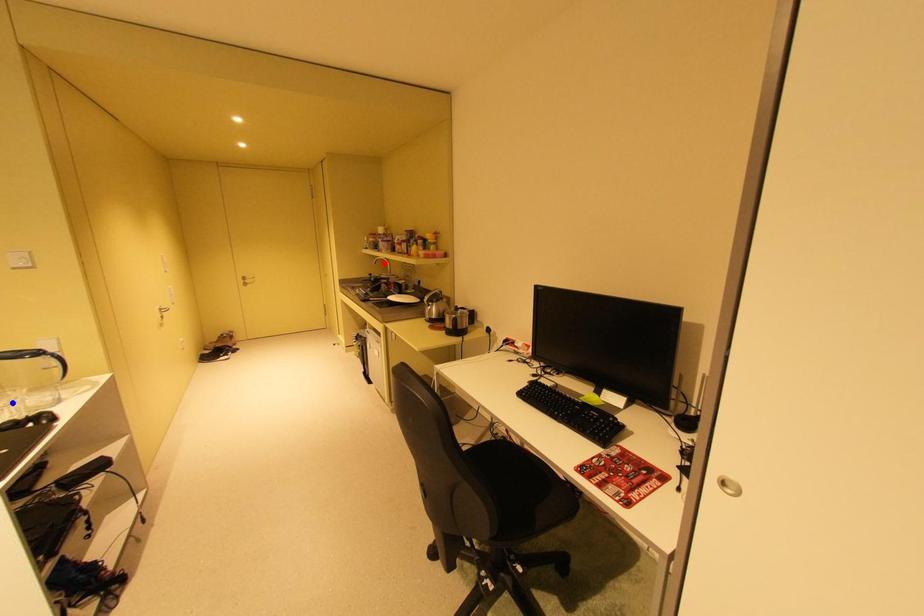
Question: Which of the two points in the image is closer to the camera?

Choices:
 (A) Blue point is closer.
 (B) Red point is closer.

Answer: (A)